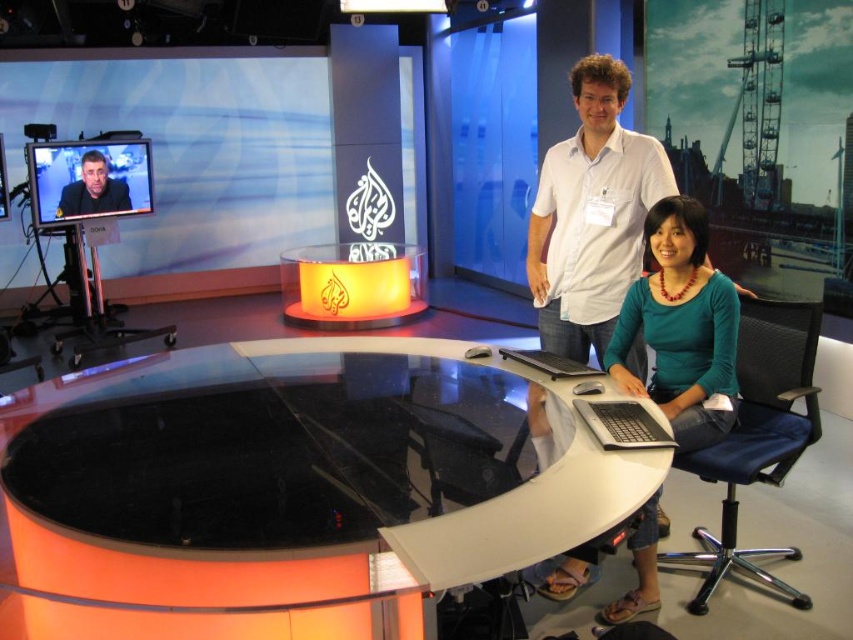
Who is higher up, teal jersey at center or matte black suit at upper left?

matte black suit at upper left is higher up.

Between teal jersey at center and matte black suit at upper left, which one appears on the right side from the viewer's perspective?

teal jersey at center

Locate an element on the screen. This screenshot has width=853, height=640. teal jersey at center is located at coordinates (682, 326).

Where is `teal jersey at center`? teal jersey at center is located at coordinates (682, 326).

Is matte black suit at upper left closer to the viewer compared to black plastic laptop at lower center?

That is False.

Which is more to the left, matte black suit at upper left or black plastic laptop at lower center?

matte black suit at upper left is more to the left.

Who is more forward, (x=102, y=192) or (x=518, y=349)?

Point (x=518, y=349) is more forward.

Where is `matte black suit at upper left`? This screenshot has width=853, height=640. matte black suit at upper left is located at coordinates (93, 189).

Which is in front, point (639, 410) or point (88, 188)?

Point (639, 410) is in front.

Does point (633, 445) come farther from viewer compared to point (103, 156)?

No.

The width and height of the screenshot is (853, 640). In order to click on silver metallic laptop at lower center in this screenshot , I will do `click(622, 422)`.